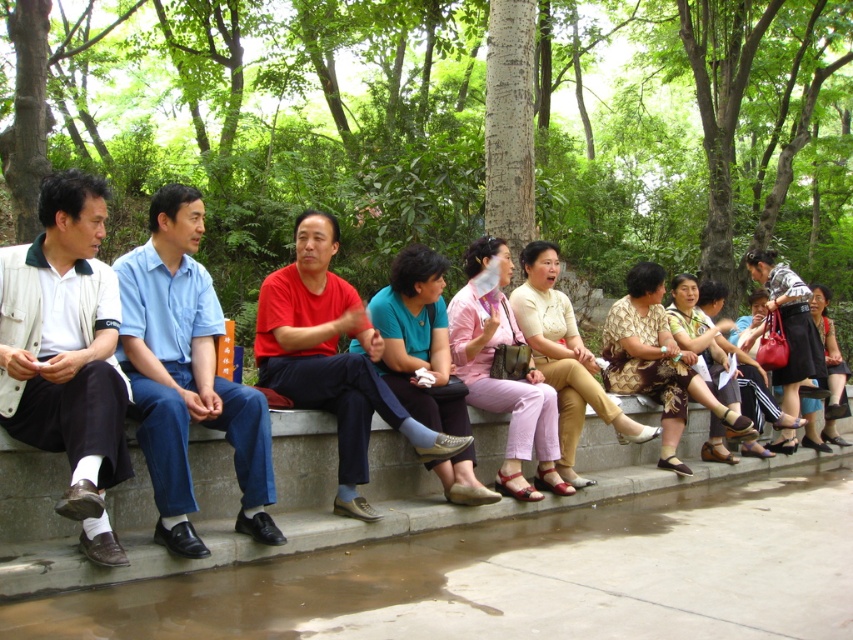
Is gray concrete curb at lower center smaller than light beige jacket at left?

Correct, gray concrete curb at lower center occupies less space than light beige jacket at left.

Identify the location of gray concrete curb at lower center. (296, 499).

Based on the photo, who is taller, gray concrete curb at lower center or red matte shirt at center?

With more height is red matte shirt at center.

Is point (15, 592) closer to viewer compared to point (312, 368)?

That is True.

Which is in front, point (498, 452) or point (277, 296)?

Point (277, 296) is more forward.

The width and height of the screenshot is (853, 640). Identify the location of gray concrete curb at lower center. (296, 499).

Does blue cotton shirt at center have a greater width compared to red matte shirt at center?

No, blue cotton shirt at center is not wider than red matte shirt at center.

Between blue cotton shirt at center and red matte shirt at center, which one has less height?

With less height is red matte shirt at center.

Between point (215, 323) and point (354, 486), which one is positioned in front?

Point (215, 323) is more forward.

Image resolution: width=853 pixels, height=640 pixels. Find the location of `blue cotton shirt at center`. blue cotton shirt at center is located at coordinates (186, 374).